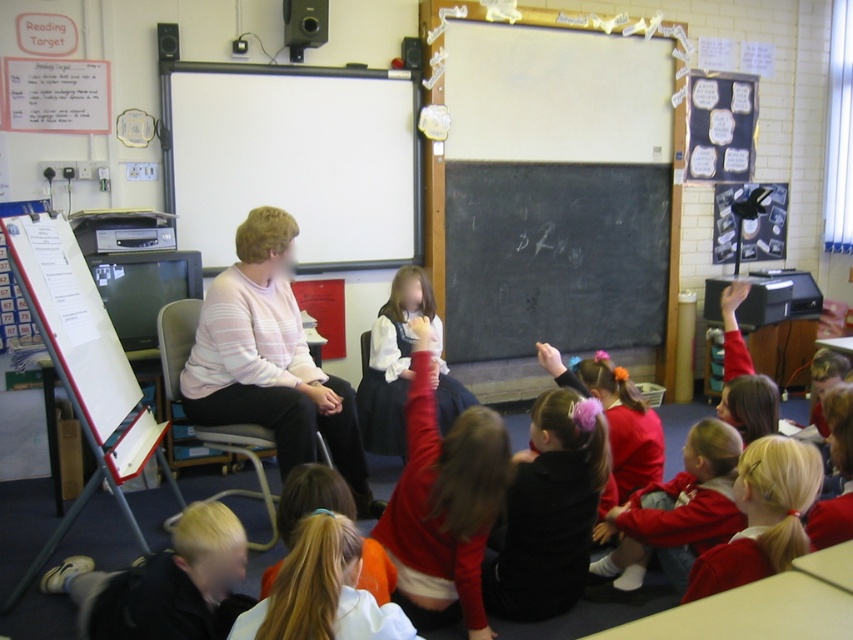
Which is below, light pink striped sweater at center or blonde hair at lower center?

blonde hair at lower center

Identify the location of light pink striped sweater at center. (270, 360).

At what (x,y) coordinates should I click in order to perform the action: click on light pink striped sweater at center. Please return your answer as a coordinate pair (x, y). The width and height of the screenshot is (853, 640). Looking at the image, I should click on (270, 360).

From the picture: Is red velvet sweater at center in front of blonde hair at lower left?

No.

Does point (422, 612) lie in front of point (154, 634)?

No, it is behind (154, 634).

At what (x,y) coordinates should I click in order to perform the action: click on red velvet sweater at center. Please return your answer as a coordinate pair (x, y). Looking at the image, I should click on (444, 502).

Can you confirm if whiteboard at upper center is wider than black chalkboard at center?

No, whiteboard at upper center is not wider than black chalkboard at center.

Does whiteboard at upper center appear under black chalkboard at center?

Result: Actually, whiteboard at upper center is above black chalkboard at center.

Between point (167, 157) and point (485, 176), which one is positioned in front?

Point (167, 157) is more forward.

Locate an element on the screen. The width and height of the screenshot is (853, 640). whiteboard at upper center is located at coordinates (294, 157).